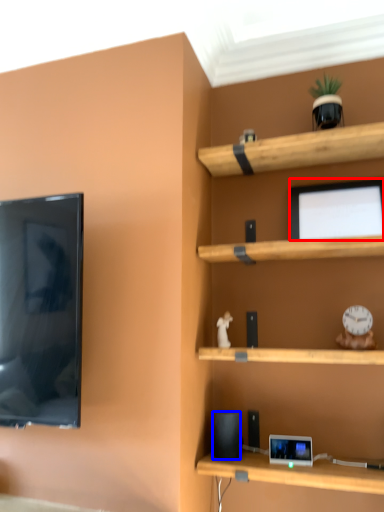
Question: Which point is further to the camera, computer monitor (highlighted by a red box) or speaker (highlighted by a blue box)?

Choices:
 (A) computer monitor
 (B) speaker

Answer: (A)